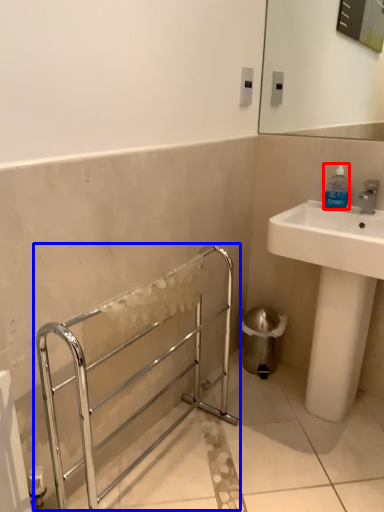
Question: Which object appears farthest to the camera in this image, bottle (highlighted by a red box) or balustrade (highlighted by a blue box)?

Choices:
 (A) bottle
 (B) balustrade

Answer: (A)